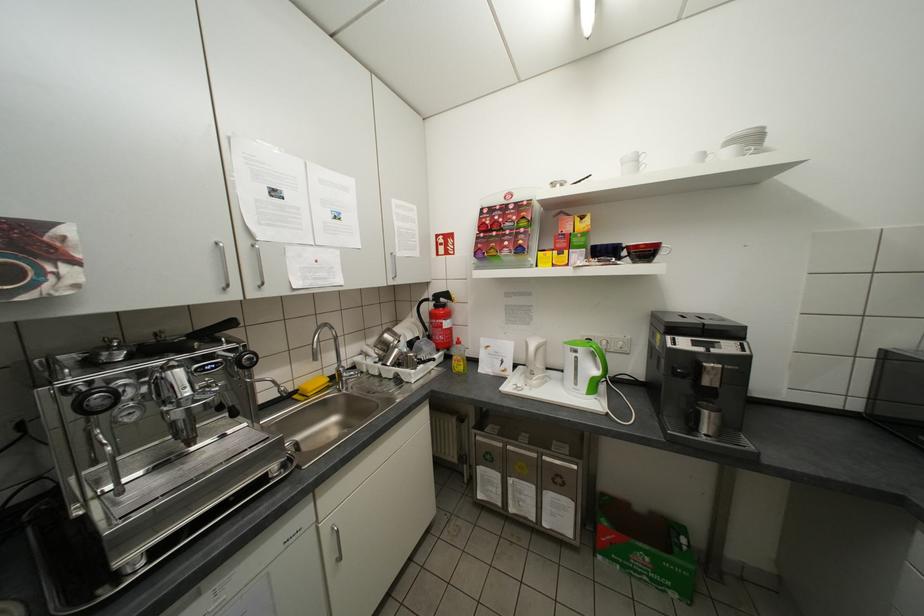
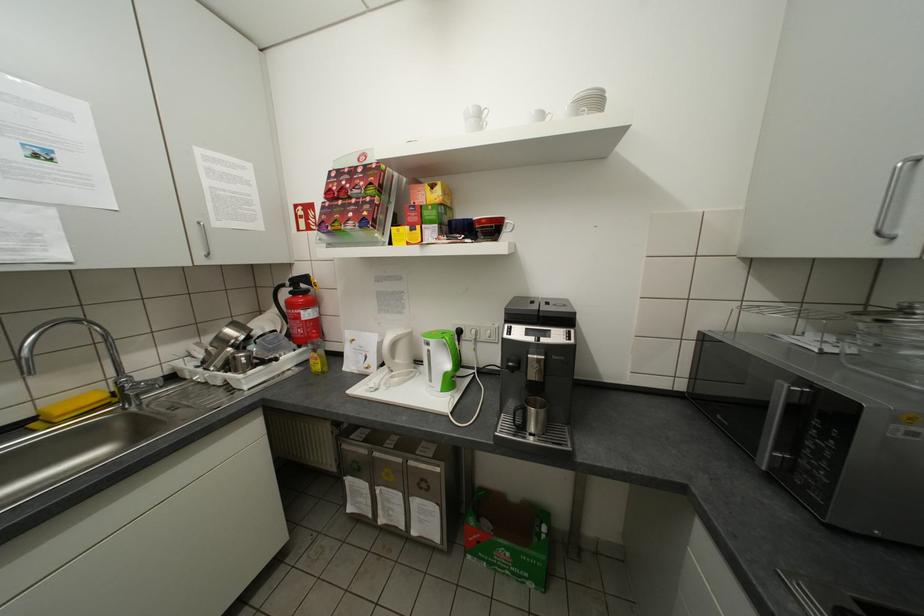
Question: What movement of the cameraman would produce the second image?

Choices:
 (A) Left
 (B) Right
 (C) Forward
 (D) Backward

Answer: (B)